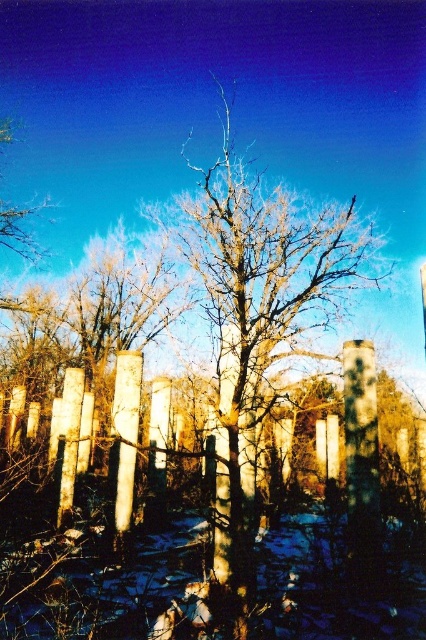
Question: Which of the following is the closest to the observer?

Choices:
 (A) bare wood tree at center
 (B) white smooth pillar at center

Answer: (A)

Question: Is white smooth pillar at center further to camera compared to wooden post at center?

Choices:
 (A) yes
 (B) no

Answer: (B)

Question: Which point is farther to the camera?

Choices:
 (A) (75, 388)
 (B) (123, 406)
 (C) (213, 260)

Answer: (C)

Question: Can you confirm if bare wood tree at center is positioned to the right of white smooth pillar at center?

Choices:
 (A) no
 (B) yes

Answer: (B)

Question: Which object appears farthest from the camera in this image?

Choices:
 (A) bare wood tree at center
 (B) wooden post at center

Answer: (B)

Question: Does bare wood tree at center have a larger size compared to white smooth pillar at center?

Choices:
 (A) no
 (B) yes

Answer: (B)